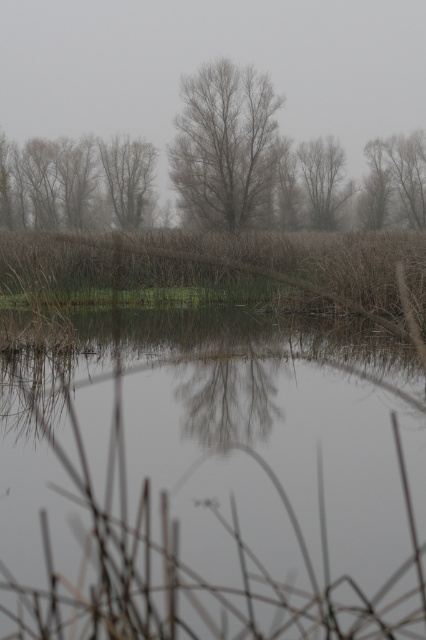
Question: Which object is positioned farthest from the bare branches at center?

Choices:
 (A) gray-brown bark tree at center
 (B) brown textured tree at upper right
 (C) brown textured trees at left

Answer: (B)

Question: Estimate the real-world distances between objects in this image. Which object is farther from the brown textured trees at left?

Choices:
 (A) smooth bark tree at center
 (B) brown textured tree at upper right
 (C) gray-brown bark tree at center

Answer: (B)

Question: In this image, where is clear water at center located relative to bare branches at center?

Choices:
 (A) left
 (B) right

Answer: (B)

Question: Can you confirm if gray-brown bark tree at center is positioned to the left of smooth bark tree at center?

Choices:
 (A) no
 (B) yes

Answer: (B)

Question: Does bare branches at center have a smaller size compared to smooth bark tree at center?

Choices:
 (A) yes
 (B) no

Answer: (A)

Question: Which of the following is the closest to the observer?

Choices:
 (A) bare branches at center
 (B) gray-brown bark tree at center

Answer: (B)